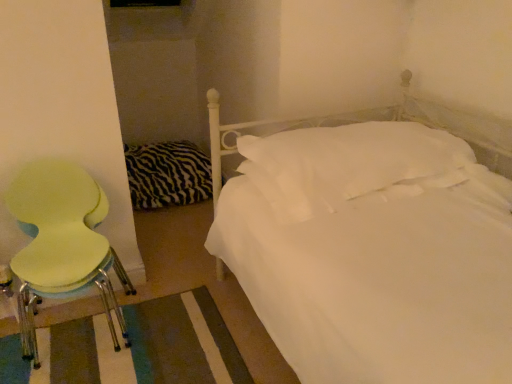
Question: Can you confirm if zebra-patterned fabric at left is positioned to the right of light green plastic chair at left?

Choices:
 (A) no
 (B) yes

Answer: (B)

Question: Can you confirm if zebra-patterned fabric at left is taller than light green plastic chair at left?

Choices:
 (A) yes
 (B) no

Answer: (B)

Question: Is zebra-patterned fabric at left further to the viewer compared to light green plastic chair at left?

Choices:
 (A) no
 (B) yes

Answer: (B)

Question: Are zebra-patterned fabric at left and light green plastic chair at left located far from each other?

Choices:
 (A) no
 (B) yes

Answer: (B)

Question: Can you confirm if zebra-patterned fabric at left is shorter than light green plastic chair at left?

Choices:
 (A) yes
 (B) no

Answer: (A)

Question: Is zebra-patterned fabric at left oriented towards light green plastic chair at left?

Choices:
 (A) yes
 (B) no

Answer: (A)

Question: Can you confirm if white soft pillow at center is positioned to the left of zebra-patterned fabric at left?

Choices:
 (A) yes
 (B) no

Answer: (B)

Question: Can you confirm if white soft pillow at center is taller than zebra-patterned fabric at left?

Choices:
 (A) no
 (B) yes

Answer: (A)

Question: Could you tell me if white soft pillow at center is facing zebra-patterned fabric at left?

Choices:
 (A) no
 (B) yes

Answer: (A)

Question: From the image's perspective, is white soft pillow at center beneath zebra-patterned fabric at left?

Choices:
 (A) yes
 (B) no

Answer: (A)

Question: Is white soft pillow at center far away from zebra-patterned fabric at left?

Choices:
 (A) no
 (B) yes

Answer: (B)

Question: Does white soft pillow at center touch zebra-patterned fabric at left?

Choices:
 (A) no
 (B) yes

Answer: (A)

Question: Considering the relative sizes of zebra-patterned fabric at left and white soft pillow at center in the image provided, is zebra-patterned fabric at left bigger than white soft pillow at center?

Choices:
 (A) yes
 (B) no

Answer: (A)